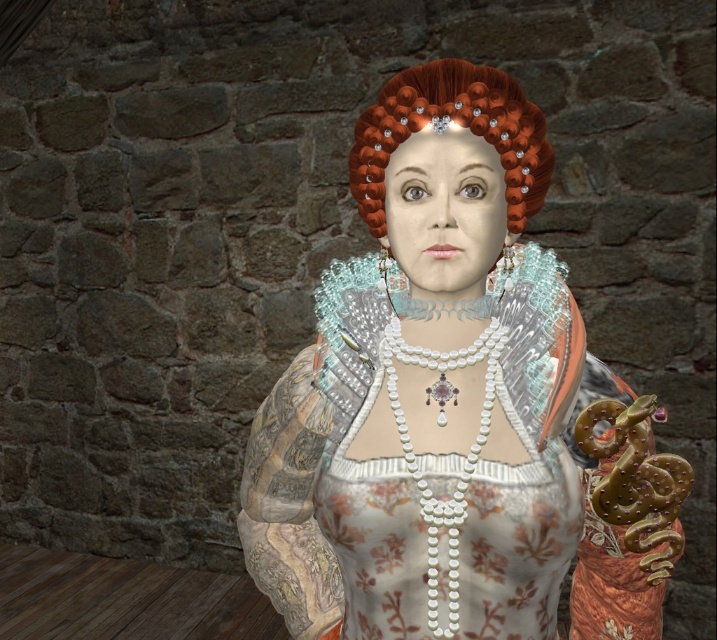
Question: Does matte silver gown at center appear under shiny orange curls at center?

Choices:
 (A) yes
 (B) no

Answer: (A)

Question: Is matte silver gown at center above shiny orange curls at center?

Choices:
 (A) yes
 (B) no

Answer: (B)

Question: Among these points, which one is nearest to the camera?

Choices:
 (A) (442, 474)
 (B) (361, 131)

Answer: (A)

Question: Does matte silver gown at center have a larger size compared to shiny orange curls at center?

Choices:
 (A) yes
 (B) no

Answer: (A)